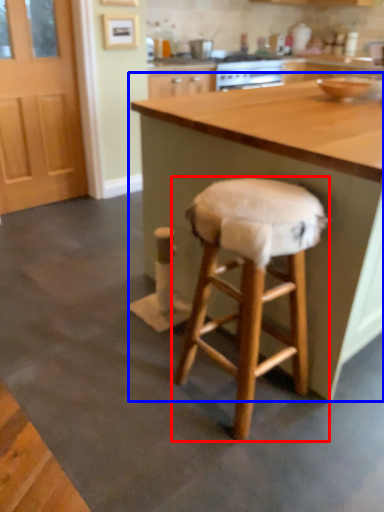
Question: Which point is further to the camera, stool (highlighted by a red box) or table (highlighted by a blue box)?

Choices:
 (A) stool
 (B) table

Answer: (B)